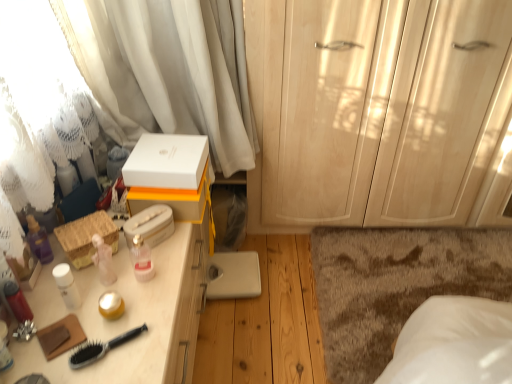
Image resolution: width=512 pixels, height=384 pixels. Find the location of `matte white desk at left`. matte white desk at left is located at coordinates (123, 318).

Describe the element at coordinates (4, 348) in the screenshot. I see `matte white lotion at left, which is the second toiletry from top to bottom` at that location.

At what (x,y) coordinates should I click in order to perform the action: click on brown shaggy rug at lower right. Please return your answer as a coordinate pair (x, y). Looking at the image, I should click on (396, 285).

You are a GUI agent. You are given a task and a screenshot of the screen. Output one action in this format:
    pyautogui.click(x=<x>, y=<y>)
    Task: Click on the woven straw basket at left, the 3th storage box viewed from the top
    This screenshot has height=384, width=512.
    Given the screenshot: What is the action you would take?
    pyautogui.click(x=86, y=237)

The image size is (512, 384). In order to click on black plastic brush at lower left in this screenshot , I will do `click(101, 348)`.

The width and height of the screenshot is (512, 384). What do you see at coordinates (101, 348) in the screenshot?
I see `black plastic brush at lower left` at bounding box center [101, 348].

Image resolution: width=512 pixels, height=384 pixels. Find the location of `matte wood cabinet at right`. matte wood cabinet at right is located at coordinates (379, 107).

Find the location of a particular element. The height and width of the screenshot is (384, 512). white matte box at center, which appears as the third storage box when ordered from the bottom is located at coordinates (167, 161).

Where is `matte white desk at left`? The image size is (512, 384). matte white desk at left is located at coordinates (123, 318).

Is there a large distance between matte wood cabinet at right and pink glossy bottle at center, which is counted as the first toiletry, starting from the top?

Yes, matte wood cabinet at right and pink glossy bottle at center, which is counted as the first toiletry, starting from the top, are located far from each other.

Looking at this image, does matte wood cabinet at right have a greater width compared to pink glossy bottle at center, the 1th toiletry viewed from the right?

Correct, the width of matte wood cabinet at right exceeds that of pink glossy bottle at center, the 1th toiletry viewed from the right.

Considering the sizes of objects matte wood cabinet at right and pink glossy bottle at center, positioned as the 2th toiletry in left-to-right order, in the image provided, who is shorter, matte wood cabinet at right or pink glossy bottle at center, positioned as the 2th toiletry in left-to-right order,?

pink glossy bottle at center, positioned as the 2th toiletry in left-to-right order.

Measure the distance from black plastic brush at lower left to matte white lotion at left, placed as the 1th toiletry when sorted from left to right.

The distance of black plastic brush at lower left from matte white lotion at left, placed as the 1th toiletry when sorted from left to right, is 7.62 inches.

From a real-world perspective, between black plastic brush at lower left and matte white lotion at left, which is the second toiletry from top to bottom, who is vertically lower?

black plastic brush at lower left, from a real-world perspective.

Based on the photo, are black plastic brush at lower left and matte white lotion at left, which ranks as the first toiletry in front-to-back order, making contact?

No.

Which is correct: black plastic brush at lower left is inside matte white lotion at left, which is the first toiletry in bottom-to-top order, or outside of it?

black plastic brush at lower left is not enclosed by matte white lotion at left, which is the first toiletry in bottom-to-top order.

In the scene shown: Do you think white sheer curtain at upper left is within white matte box at center, the first storage box from the top, or outside of it?

white sheer curtain at upper left is outside white matte box at center, the first storage box from the top.

Considering the relative positions of white sheer curtain at upper left and white matte box at center, the first storage box from the top, in the image provided, is white sheer curtain at upper left to the right of white matte box at center, the first storage box from the top, from the viewer's perspective?

No, white sheer curtain at upper left is not to the right of white matte box at center, the first storage box from the top.

From a real-world perspective, who is located higher, white sheer curtain at upper left or white matte box at center, which appears as the third storage box when ordered from the bottom?

white sheer curtain at upper left, from a real-world perspective.

Does pink glossy bottle at center, which is counted as the first toiletry, starting from the top, turn towards matte white desk at left?

No.

Which point is more distant from viewer, [141,273] or [19,373]?

Positioned behind is point [141,273].

From a real-world perspective, is pink glossy bottle at center, the 1th toiletry in the back-to-front sequence, physically below matte white desk at left?

No, from a real-world perspective, pink glossy bottle at center, the 1th toiletry in the back-to-front sequence, is not under matte white desk at left.

From the picture: Is the position of pink glossy bottle at center, which is counted as the first toiletry, starting from the top, less distant than that of matte white desk at left?

No, it is not.

Relative to pink glossy bottle at center, positioned as the 2th toiletry in left-to-right order, is white matte tissue box at upper center, arranged as the second storage box when ordered from the bottom, in front or behind?

Visually, white matte tissue box at upper center, arranged as the second storage box when ordered from the bottom, is located behind pink glossy bottle at center, positioned as the 2th toiletry in left-to-right order.

From a real-world perspective, is white matte tissue box at upper center, positioned as the 2th storage box in top-to-bottom order, above or below pink glossy bottle at center, the 1th toiletry viewed from the right?

white matte tissue box at upper center, positioned as the 2th storage box in top-to-bottom order, is situated lower than pink glossy bottle at center, the 1th toiletry viewed from the right, in the real world.

Between point (170, 225) and point (139, 281), which one is positioned in front?

The point (139, 281) is in front.

Is white matte tissue box at upper center, arranged as the second storage box when ordered from the bottom, taller or shorter than pink glossy bottle at center, the 1th toiletry in the back-to-front sequence?

Clearly, white matte tissue box at upper center, arranged as the second storage box when ordered from the bottom, is shorter compared to pink glossy bottle at center, the 1th toiletry in the back-to-front sequence.

Is matte white desk at left touching white matte tissue box at upper center, positioned as the 2th storage box in top-to-bottom order?

There is a gap between matte white desk at left and white matte tissue box at upper center, positioned as the 2th storage box in top-to-bottom order.

Does point (146, 373) come in front of point (141, 214)?

Yes, it is in front of point (141, 214).

Based on the photo, which of these two, matte white desk at left or white matte tissue box at upper center, positioned as the 2th storage box in top-to-bottom order, stands shorter?

With less height is white matte tissue box at upper center, positioned as the 2th storage box in top-to-bottom order.

Based on the photo, what's the angular difference between white matte box at center, the first storage box from the top, and white sheer curtain at upper left's facing directions?

The angular difference between white matte box at center, the first storage box from the top, and white sheer curtain at upper left is 43 degrees.

This screenshot has height=384, width=512. In order to click on the 2nd storage box counting from the right of the white sheer curtain at upper left in this screenshot , I will do `click(167, 161)`.

From the image's perspective, is white matte box at center, the first storage box from the top, on top of white sheer curtain at upper left?

No, from the image's perspective, white matte box at center, the first storage box from the top, is not above white sheer curtain at upper left.

Considering the sizes of objects white matte box at center, which appears as the third storage box when ordered from the bottom, and white sheer curtain at upper left in the image provided, who is smaller, white matte box at center, which appears as the third storage box when ordered from the bottom, or white sheer curtain at upper left?

white matte box at center, which appears as the third storage box when ordered from the bottom, is smaller.

The height and width of the screenshot is (384, 512). In order to click on cabinetry above the pink glossy bottle at center, the 1th toiletry in the back-to-front sequence (from the image's perspective) in this screenshot , I will do `click(379, 107)`.

The height and width of the screenshot is (384, 512). What are the coordinates of `brush below the matte white lotion at left, which ranks as the first toiletry in front-to-back order (from the image's perspective)` in the screenshot? It's located at (101, 348).

From the image, which object appears to be farther from brown shaggy rug at lower right, woven straw basket at left, arranged as the first storage box when ordered from the bottom, or white sheer curtain at upper left?

woven straw basket at left, arranged as the first storage box when ordered from the bottom.

Looking at the image, which one is located further to matte wood cabinet at right, matte white desk at left or brown shaggy rug at lower right?

matte white desk at left lies further to matte wood cabinet at right than the other object.

In the scene shown: Estimate the real-world distances between objects in this image. Which object is closer to woven straw basket at left, the 3th storage box viewed from the top, matte white desk at left or white matte tissue box at upper center, positioned as the 2th storage box in top-to-bottom order?

white matte tissue box at upper center, positioned as the 2th storage box in top-to-bottom order, lies closer to woven straw basket at left, the 3th storage box viewed from the top, than the other object.

Based on their spatial positions, is white matte box at center, the first storage box from the top, or matte wood cabinet at right further from white sheer curtain at upper left?

matte wood cabinet at right is further to white sheer curtain at upper left.

Considering their positions, is white matte box at center, which appears as the third storage box when ordered from the bottom, positioned closer to matte white lotion at left, acting as the 2th toiletry starting from the right, than black plastic brush at lower left?

black plastic brush at lower left is closer to matte white lotion at left, acting as the 2th toiletry starting from the right.

When comparing their distances from white matte tissue box at upper center, positioned as the 2th storage box in top-to-bottom order, does matte wood cabinet at right or white sheer curtain at upper left seem closer?

Among the two, white sheer curtain at upper left is located nearer to white matte tissue box at upper center, positioned as the 2th storage box in top-to-bottom order.

Which object lies nearer to the anchor point white sheer curtain at upper left, matte white lotion at left, acting as the 2th toiletry starting from the right, or matte wood cabinet at right?

matte wood cabinet at right is closer to white sheer curtain at upper left.

Estimate the real-world distances between objects in this image. Which object is closer to black plastic brush at lower left, white matte box at center, which appears as the third storage box when ordered from the bottom, or brown shaggy rug at lower right?

Among the two, white matte box at center, which appears as the third storage box when ordered from the bottom, is located nearer to black plastic brush at lower left.

Where is `desk located between matte white lotion at left, which is the second toiletry from top to bottom, and white matte tissue box at upper center, arranged as the second storage box when ordered from the bottom, in the depth direction`? This screenshot has width=512, height=384. desk located between matte white lotion at left, which is the second toiletry from top to bottom, and white matte tissue box at upper center, arranged as the second storage box when ordered from the bottom, in the depth direction is located at coordinates 123,318.

Where is `toiletry between matte white desk at left and white matte tissue box at upper center, positioned as the 2th storage box in top-to-bottom order, in the front-back direction`? Image resolution: width=512 pixels, height=384 pixels. toiletry between matte white desk at left and white matte tissue box at upper center, positioned as the 2th storage box in top-to-bottom order, in the front-back direction is located at coordinates (142, 259).

This screenshot has height=384, width=512. In order to click on toiletry between black plastic brush at lower left and white matte tissue box at upper center, arranged as the second storage box when ordered from the bottom, along the z-axis in this screenshot , I will do `click(142, 259)`.

In order to click on brush between white sheer curtain at upper left and brown shaggy rug at lower right in this screenshot , I will do `click(101, 348)`.